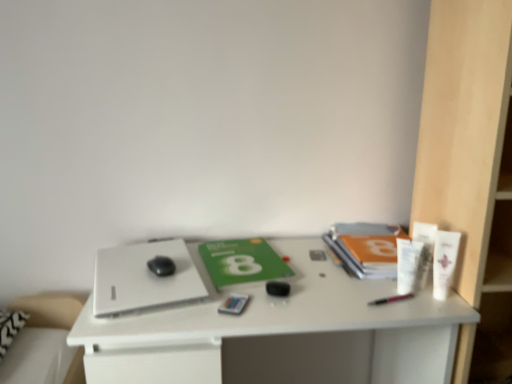
This screenshot has height=384, width=512. Find the location of `white plastic tube at right, the second toiletry in the left-to-right sequence`. white plastic tube at right, the second toiletry in the left-to-right sequence is located at coordinates (424, 251).

The height and width of the screenshot is (384, 512). What do you see at coordinates (280, 332) in the screenshot?
I see `white matte desk at center` at bounding box center [280, 332].

What do you see at coordinates (444, 262) in the screenshot? I see `white matte tube at upper right, the 1th toiletry in the right-to-left sequence` at bounding box center [444, 262].

Where is `black plastic pen at center, arranged as the 1th stationery when viewed from the right`? The image size is (512, 384). black plastic pen at center, arranged as the 1th stationery when viewed from the right is located at coordinates (390, 299).

In order to face orange matte book at right, arranged as the second paperback book when viewed from the left, should I rotate leftwards or rightwards?

Rotate your view right by about 15.724°.

Locate an element on the screen. The width and height of the screenshot is (512, 384). orange matte book at right, the first paperback book when ordered from right to left is located at coordinates (366, 248).

At what (x,y) coordinates should I click in order to perform the action: click on green matte paperback book at center, the second paperback book in the right-to-left sequence. Please return your answer as a coordinate pair (x, y). This screenshot has width=512, height=384. Looking at the image, I should click on (242, 261).

In order to face green matte paperback book at center, the second paperback book in the right-to-left sequence, should I rotate leftwards or rightwards?

A 1.845 degree turn to the left will do.

Identify the location of white plastic tube at right, which is the 2th toiletry in right-to-left order. (424, 251).

Is black plastic pen at center, arranged as the 1th stationery when viewed from the right, oriented towards white matte tube at upper right, the 1th toiletry in the right-to-left sequence?

No, black plastic pen at center, arranged as the 1th stationery when viewed from the right, is not facing towards white matte tube at upper right, the 1th toiletry in the right-to-left sequence.

Are black plastic pen at center, which is counted as the 2th stationery, starting from the left, and white matte tube at upper right, the 1th toiletry in the right-to-left sequence, far apart?

No, there isn't a large distance between black plastic pen at center, which is counted as the 2th stationery, starting from the left, and white matte tube at upper right, the 1th toiletry in the right-to-left sequence.

What's the angular difference between black plastic pen at center, arranged as the 1th stationery when viewed from the right, and white matte tube at upper right, which is the 3th toiletry from left to right,'s facing directions?

black plastic pen at center, arranged as the 1th stationery when viewed from the right, and white matte tube at upper right, which is the 3th toiletry from left to right, are facing 38.1 degrees away from each other.

Can we say white plastic bookshelf at right lies outside white plastic tube at right, the first toiletry from the left?

That's correct, white plastic bookshelf at right is outside of white plastic tube at right, the first toiletry from the left.

Is white plastic bookshelf at right positioned behind white plastic tube at right, the third toiletry positioned from the right?

No, the depth of white plastic bookshelf at right is less than that of white plastic tube at right, the third toiletry positioned from the right.

Can you confirm if white plastic bookshelf at right is positioned to the right of white plastic tube at right, the third toiletry positioned from the right?

Yes.

Is white plastic bookshelf at right not near white plastic tube at right, the first toiletry from the left?

Actually, white plastic bookshelf at right and white plastic tube at right, the first toiletry from the left, are a little close together.

Is white plastic tube at right, the second toiletry in the left-to-right sequence, located outside black plastic pen at center, which is counted as the 2th stationery, starting from the left?

That's correct, white plastic tube at right, the second toiletry in the left-to-right sequence, is outside of black plastic pen at center, which is counted as the 2th stationery, starting from the left.

Is white plastic tube at right, which is the 2th toiletry in right-to-left order, bigger than black plastic pen at center, which is counted as the 2th stationery, starting from the left?

Yes, white plastic tube at right, which is the 2th toiletry in right-to-left order, is bigger than black plastic pen at center, which is counted as the 2th stationery, starting from the left.

Is white plastic tube at right, which is the 2th toiletry in right-to-left order, far from black plastic pen at center, which is counted as the 2th stationery, starting from the left?

white plastic tube at right, which is the 2th toiletry in right-to-left order, is actually quite close to black plastic pen at center, which is counted as the 2th stationery, starting from the left.

Is green matte paperback book at center, the second paperback book in the right-to-left sequence, inside or outside of white matte laptop at left?

green matte paperback book at center, the second paperback book in the right-to-left sequence, lies outside white matte laptop at left.

From the image's perspective, which object appears higher, green matte paperback book at center, the first paperback book viewed from the left, or white matte laptop at left?

green matte paperback book at center, the first paperback book viewed from the left.

You are a GUI agent. You are given a task and a screenshot of the screen. Output one action in this format:
    pyautogui.click(x=<x>, y=<y>)
    Task: Click on the laptop located in front of the green matte paperback book at center, the second paperback book in the right-to-left sequence
    The height and width of the screenshot is (384, 512).
    Given the screenshot: What is the action you would take?
    pyautogui.click(x=143, y=277)

Can you confirm if green matte paperback book at center, the first paperback book viewed from the left, is positioned to the left of white matte laptop at left?

In fact, green matte paperback book at center, the first paperback book viewed from the left, is to the right of white matte laptop at left.

From a real-world perspective, is matte plastic card at center, which appears as the first stationery when viewed from the left, located beneath black plastic pen at center, which is counted as the 2th stationery, starting from the left?

Yes, from a real-world perspective, matte plastic card at center, which appears as the first stationery when viewed from the left, is under black plastic pen at center, which is counted as the 2th stationery, starting from the left.

Based on the photo, could you tell me if matte plastic card at center, marked as the second stationery in a right-to-left arrangement, is turned towards black plastic pen at center, arranged as the 1th stationery when viewed from the right?

No, matte plastic card at center, marked as the second stationery in a right-to-left arrangement, does not turn towards black plastic pen at center, arranged as the 1th stationery when viewed from the right.

Which object is further away from the camera taking this photo, matte plastic card at center, which appears as the first stationery when viewed from the left, or black plastic pen at center, arranged as the 1th stationery when viewed from the right?

black plastic pen at center, arranged as the 1th stationery when viewed from the right, is further from the camera.

Considering the positions of point (246, 296) and point (405, 298), is point (246, 296) closer or farther from the camera than point (405, 298)?

Point (246, 296).

From a real-world perspective, is white plastic bookshelf at right positioned under white matte desk at center based on gravity?

Actually, white plastic bookshelf at right is physically above white matte desk at center in the real world.

Can you confirm if white plastic bookshelf at right is bigger than white matte desk at center?

Actually, white plastic bookshelf at right might be smaller than white matte desk at center.

Which object is positioned more to the right, white plastic bookshelf at right or white matte desk at center?

white plastic bookshelf at right.

From a real-world perspective, between matte plastic card at center, which appears as the first stationery when viewed from the left, and white matte tube at upper right, the 1th toiletry in the right-to-left sequence, who is vertically lower?

matte plastic card at center, which appears as the first stationery when viewed from the left, from a real-world perspective.

How far apart are matte plastic card at center, marked as the second stationery in a right-to-left arrangement, and white matte tube at upper right, which is the 3th toiletry from left to right?

matte plastic card at center, marked as the second stationery in a right-to-left arrangement, and white matte tube at upper right, which is the 3th toiletry from left to right, are 18.92 inches apart from each other.

Is matte plastic card at center, marked as the second stationery in a right-to-left arrangement, not within white matte tube at upper right, the 1th toiletry in the right-to-left sequence?

Yes, matte plastic card at center, marked as the second stationery in a right-to-left arrangement, is outside of white matte tube at upper right, the 1th toiletry in the right-to-left sequence.

Are matte plastic card at center, marked as the second stationery in a right-to-left arrangement, and white matte tube at upper right, which is the 3th toiletry from left to right, beside each other?

No, matte plastic card at center, marked as the second stationery in a right-to-left arrangement, is not in contact with white matte tube at upper right, which is the 3th toiletry from left to right.

This screenshot has height=384, width=512. What are the coordinates of `the 3rd toiletry to the right of the black plastic pen at center, which is counted as the 2th stationery, starting from the left, starting your count from the anchor` in the screenshot? It's located at (444, 262).

This screenshot has height=384, width=512. I want to click on toiletry that is the 2nd object located behind the white plastic bookshelf at right, so click(407, 265).

Which object lies nearer to the anchor point black matte mouse at center, black plastic pen at center, which is counted as the 2th stationery, starting from the left, or white plastic bookshelf at right?

black plastic pen at center, which is counted as the 2th stationery, starting from the left, lies closer to black matte mouse at center than the other object.

Based on their spatial positions, is white matte laptop at left or orange matte book at right, the first paperback book when ordered from right to left, closer to white plastic tube at right, which is the 2th toiletry in right-to-left order?

The object closer to white plastic tube at right, which is the 2th toiletry in right-to-left order, is orange matte book at right, the first paperback book when ordered from right to left.

Estimate the real-world distances between objects in this image. Which object is closer to white plastic tube at right, which is the 2th toiletry in right-to-left order, white matte desk at center or matte plastic card at center, marked as the second stationery in a right-to-left arrangement?

white matte desk at center is positioned closer to the anchor white plastic tube at right, which is the 2th toiletry in right-to-left order.

When comparing their distances from white matte desk at center, does matte plastic card at center, which appears as the first stationery when viewed from the left, or white plastic tube at right, the third toiletry positioned from the right, seem further?

Among the two, white plastic tube at right, the third toiletry positioned from the right, is located further to white matte desk at center.

Considering their positions, is black plastic pen at center, which is counted as the 2th stationery, starting from the left, positioned closer to orange matte book at right, the first paperback book when ordered from right to left, than white plastic tube at right, the third toiletry positioned from the right?

The object closer to orange matte book at right, the first paperback book when ordered from right to left, is white plastic tube at right, the third toiletry positioned from the right.

Which object lies nearer to the anchor point black plastic pen at center, which is counted as the 2th stationery, starting from the left, black matte mouse at center or green matte paperback book at center, the second paperback book in the right-to-left sequence?

green matte paperback book at center, the second paperback book in the right-to-left sequence, is positioned closer to the anchor black plastic pen at center, which is counted as the 2th stationery, starting from the left.

From the image, which object appears to be nearer to black matte mouse at center, white plastic tube at right, the first toiletry from the left, or black plastic pen at center, which is counted as the 2th stationery, starting from the left?

black plastic pen at center, which is counted as the 2th stationery, starting from the left.

Estimate the real-world distances between objects in this image. Which object is further from white matte laptop at left, white plastic tube at right, the third toiletry positioned from the right, or white matte tube at upper right, the 1th toiletry in the right-to-left sequence?

white matte tube at upper right, the 1th toiletry in the right-to-left sequence.

You are a GUI agent. You are given a task and a screenshot of the screen. Output one action in this format:
    pyautogui.click(x=<x>, y=<y>)
    Task: Click on the desk between matte plastic card at center, marked as the second stationery in a right-to-left arrangement, and black plastic pen at center, which is counted as the 2th stationery, starting from the left, from left to right
    The width and height of the screenshot is (512, 384).
    Given the screenshot: What is the action you would take?
    pyautogui.click(x=280, y=332)

Locate an element on the screen. This screenshot has height=384, width=512. stationery located between matte plastic card at center, which appears as the first stationery when viewed from the left, and white matte tube at upper right, the 1th toiletry in the right-to-left sequence, in the left-right direction is located at coordinates (390, 299).

I want to click on desk between black matte mouse at center and white matte tube at upper right, the 1th toiletry in the right-to-left sequence, so click(x=280, y=332).

You are a GUI agent. You are given a task and a screenshot of the screen. Output one action in this format:
    pyautogui.click(x=<x>, y=<y>)
    Task: Click on the paperback book between green matte paperback book at center, the first paperback book viewed from the left, and white plastic tube at right, the second toiletry in the left-to-right sequence, in the horizontal direction
    The image size is (512, 384).
    Given the screenshot: What is the action you would take?
    pos(366,248)